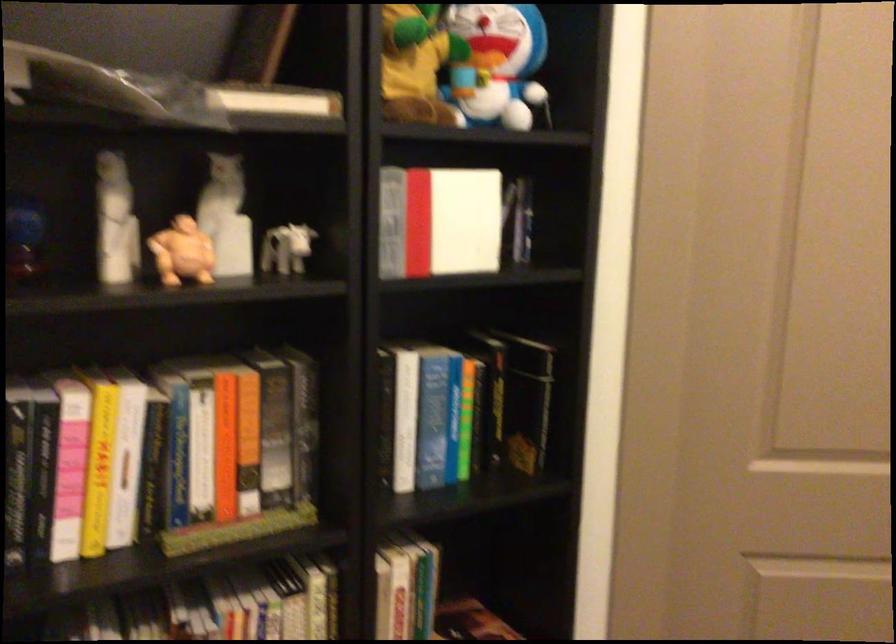
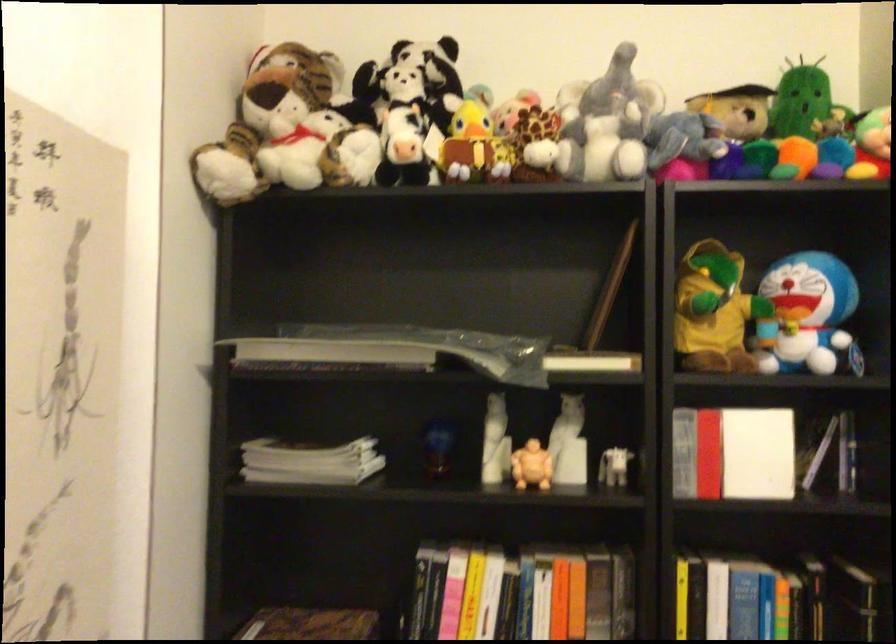
Find the pixel in the second image that matches (x=122, y=225) in the first image.

(495, 442)